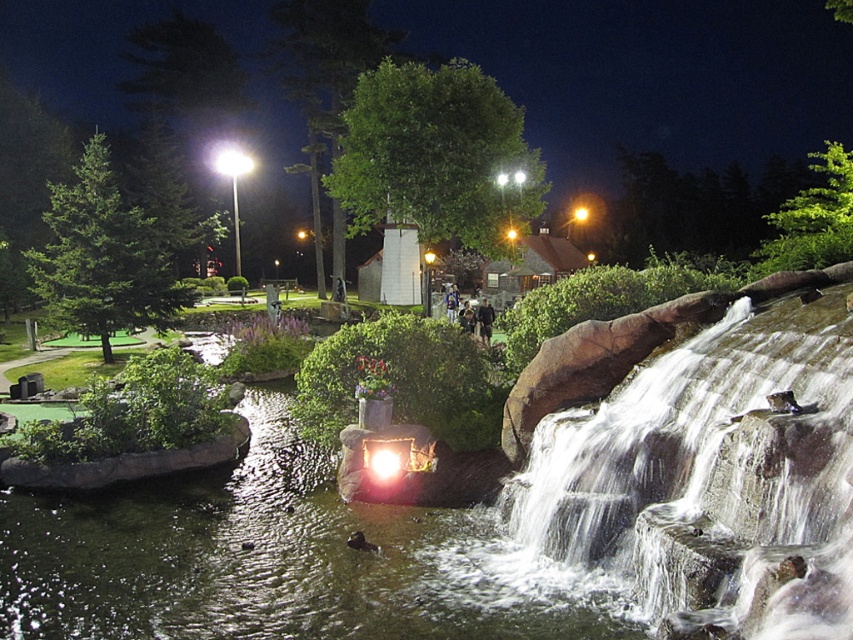
Does green leafy trees at upper center have a greater height compared to black fabric person at center?

Yes, green leafy trees at upper center is taller than black fabric person at center.

Does green leafy trees at upper center have a greater width compared to black fabric person at center?

Yes.

Which is behind, point (544, 35) or point (485, 339)?

The point (544, 35) is behind.

You are a GUI agent. You are given a task and a screenshot of the screen. Output one action in this format:
    pyautogui.click(x=<x>, y=<y>)
    Task: Click on the green leafy trees at upper center
    The height and width of the screenshot is (640, 853).
    Given the screenshot: What is the action you would take?
    pyautogui.click(x=648, y=76)

Describe the element at coordinates (699, 483) in the screenshot. The width and height of the screenshot is (853, 640). I see `clear water at center` at that location.

Measure the distance between point (552, 467) and camera.

Point (552, 467) is 6.87 meters from camera.

Who is more distant from viewer, (711, 481) or (492, 320)?

Point (492, 320)

This screenshot has height=640, width=853. I want to click on clear water at center, so click(699, 483).

Between clear water at center and green leafy trees at upper center, which one has more height?

Standing taller between the two is green leafy trees at upper center.

Does point (846, 388) come closer to viewer compared to point (610, 100)?

Yes, point (846, 388) is in front of point (610, 100).

The image size is (853, 640). In order to click on clear water at center in this screenshot , I will do coord(699,483).